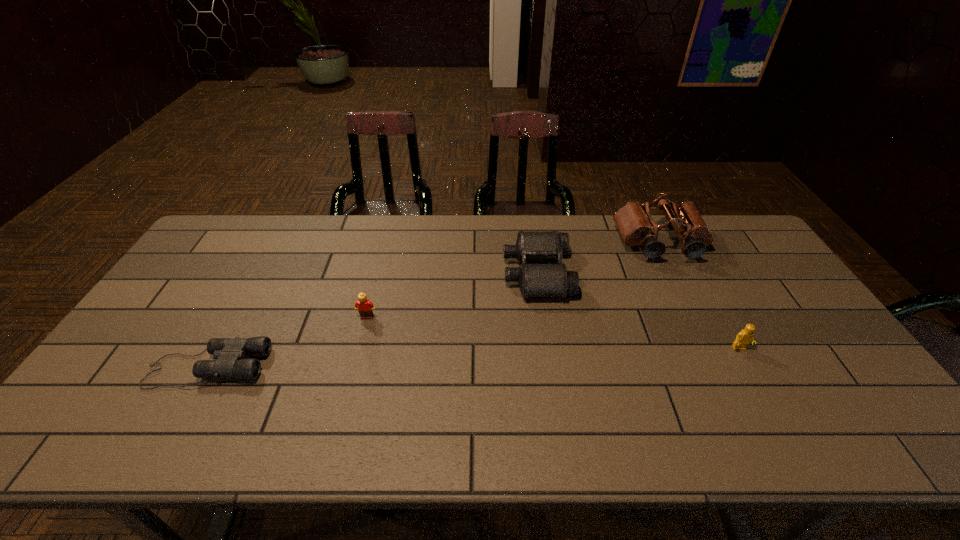
Image resolution: width=960 pixels, height=540 pixels. I want to click on free region that satisfies the following two spatial constraints: 1. through the eyepieces of the tallest binoculars; 2. at the eyepiece of the leftmost object, so click(x=720, y=367).

This screenshot has width=960, height=540. Identify the location of free space that satisfies the following two spatial constraints: 1. through the eyepieces of the rightmost binoculars; 2. at the eyepiece of the shortest binoculars. (720, 367).

Find the location of a particular element. vacant point that satisfies the following two spatial constraints: 1. through the eyepieces of the third object from left to right; 2. on the face of the third farthest object is located at coordinates (543, 318).

Where is `vacant space that satisfies the following two spatial constraints: 1. on the face of the nearer Lego; 2. at the eyepiece of the leftmost binoculars`? vacant space that satisfies the following two spatial constraints: 1. on the face of the nearer Lego; 2. at the eyepiece of the leftmost binoculars is located at coordinates (750, 367).